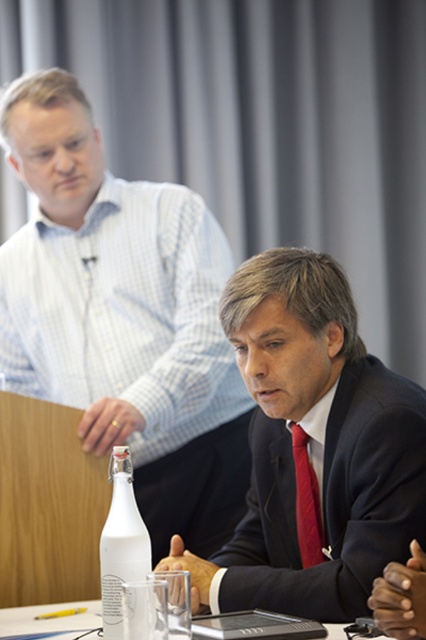
You are standing at point (0, 124) in the conference room. If you want to move to the podium where the presenter is standing, which direction should you walk? The camera is 1.96 meters away from your current position.

Since the camera is 1.96 meters away from point (0, 124), you should walk towards the direction of the camera to reach the podium where the presenter is standing.

You are attending a meeting and need to pass a document to the person in the matte black suit at center. The white glass bottle at center is in your way. Can you slide the document under the bottle or does it need to be moved?

The matte black suit at center is above the white glass bottle at center, so the bottle is below the suit. Since the bottle is on the table and the suit is worn by the person sitting at the table, you would need to move the white glass bottle at center out of the way to pass the document directly to the person in the matte black suit at center.